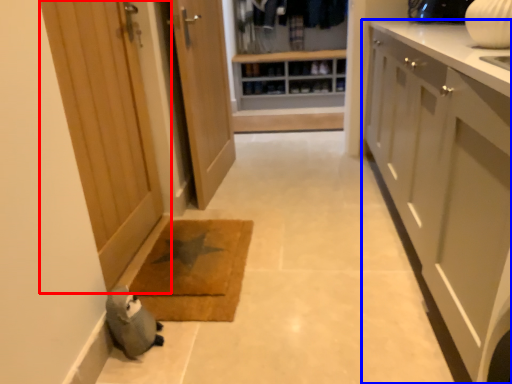
Question: Which object is closer to the camera taking this photo, door (highlighted by a red box) or cabinetry (highlighted by a blue box)?

Choices:
 (A) door
 (B) cabinetry

Answer: (B)